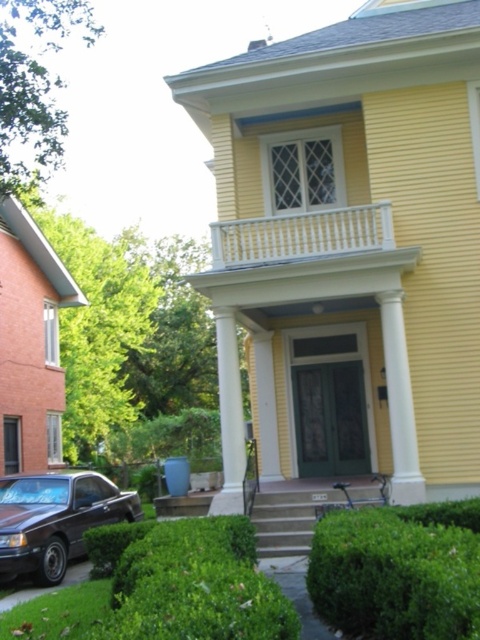
Question: Does shiny brown car at lower left appear over white painted wood railing at upper center?

Choices:
 (A) no
 (B) yes

Answer: (A)

Question: Does green leafy hedge at lower right appear under white painted wood railing at upper center?

Choices:
 (A) yes
 (B) no

Answer: (A)

Question: Which of the following is the closest to the observer?

Choices:
 (A) (252, 241)
 (B) (108, 520)

Answer: (A)

Question: Estimate the real-world distances between objects in this image. Which object is closer to the green leafy hedge at lower right?

Choices:
 (A) white painted wood railing at upper center
 (B) shiny brown car at lower left

Answer: (B)

Question: Among these objects, which one is farthest from the camera?

Choices:
 (A) green leafy hedge at lower right
 (B) shiny brown car at lower left

Answer: (B)

Question: Is green leafy hedge at lower right smaller than white painted wood railing at upper center?

Choices:
 (A) no
 (B) yes

Answer: (A)